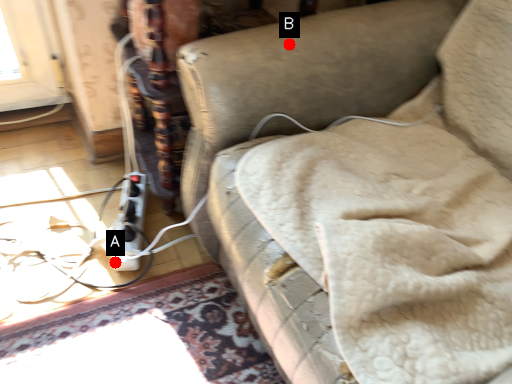
Question: Two points are circled on the image, labeled by A and B beside each circle. Which of the following is the closest to the observer?

Choices:
 (A) A is closer
 (B) B is closer

Answer: (B)